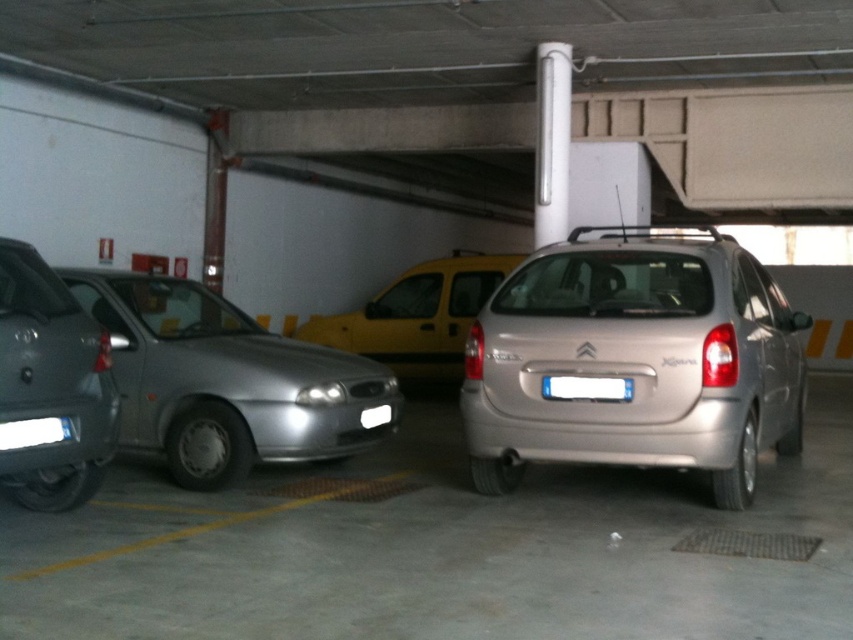
Question: Which object is farther from the camera taking this photo?

Choices:
 (A) satin silver sedan at left
 (B) white plastic license plate at center
 (C) yellow matte van at center
 (D) silver metallic hatchback at left

Answer: (C)

Question: Among these points, which one is nearest to the camera?

Choices:
 (A) (469, 392)
 (B) (374, 388)
 (C) (611, 392)
 (D) (68, 355)

Answer: (D)

Question: Which point is closer to the camera taking this photo?

Choices:
 (A) (109, 384)
 (B) (219, 397)

Answer: (A)

Question: Is satin silver sedan at left behind yellow matte van at center?

Choices:
 (A) yes
 (B) no

Answer: (B)

Question: Can you confirm if yellow matte van at center is positioned below white plastic license plate at center?

Choices:
 (A) no
 (B) yes

Answer: (A)

Question: Is satin gold hatchback at center closer to the viewer compared to silver metallic hatchback at left?

Choices:
 (A) yes
 (B) no

Answer: (B)